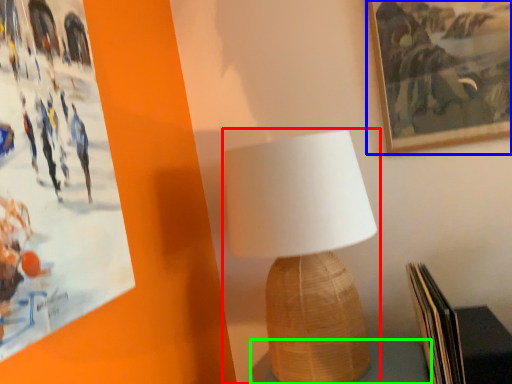
Question: Which object is the farthest from lamp (highlighted by a red box)? Choose among these: picture frame (highlighted by a blue box) or table (highlighted by a green box).

Choices:
 (A) picture frame
 (B) table

Answer: (A)